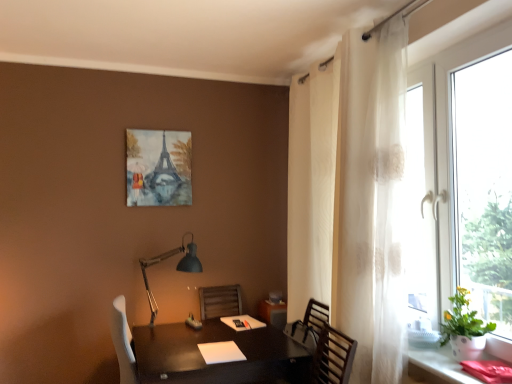
Question: From the image's perspective, is watercolor paper painting of eiffel tower at upper center above white sheer curtain at right?

Choices:
 (A) yes
 (B) no

Answer: (A)

Question: Considering the relative positions of watercolor paper painting of eiffel tower at upper center and white sheer curtain at right in the image provided, is watercolor paper painting of eiffel tower at upper center behind white sheer curtain at right?

Choices:
 (A) yes
 (B) no

Answer: (A)

Question: Is watercolor paper painting of eiffel tower at upper center facing away from white sheer curtain at right?

Choices:
 (A) no
 (B) yes

Answer: (A)

Question: Does watercolor paper painting of eiffel tower at upper center turn towards white sheer curtain at right?

Choices:
 (A) no
 (B) yes

Answer: (A)

Question: From the image's perspective, is watercolor paper painting of eiffel tower at upper center beneath white sheer curtain at right?

Choices:
 (A) yes
 (B) no

Answer: (B)

Question: Visually, is watercolor paper painting of eiffel tower at upper center positioned to the left or to the right of shiny dark wood table at center?

Choices:
 (A) left
 (B) right

Answer: (A)

Question: From the image's perspective, relative to shiny dark wood table at center, is watercolor paper painting of eiffel tower at upper center above or below?

Choices:
 (A) below
 (B) above

Answer: (B)

Question: Relative to shiny dark wood table at center, is watercolor paper painting of eiffel tower at upper center in front or behind?

Choices:
 (A) front
 (B) behind

Answer: (B)

Question: Is watercolor paper painting of eiffel tower at upper center spatially inside shiny dark wood table at center, or outside of it?

Choices:
 (A) inside
 (B) outside

Answer: (B)

Question: Looking at the image, does matte black desk at lower right seem bigger or smaller compared to watercolor paper painting of eiffel tower at upper center?

Choices:
 (A) big
 (B) small

Answer: (B)

Question: From a real-world perspective, is matte black desk at lower right physically located above or below watercolor paper painting of eiffel tower at upper center?

Choices:
 (A) below
 (B) above

Answer: (A)

Question: Is matte black desk at lower right taller or shorter than watercolor paper painting of eiffel tower at upper center?

Choices:
 (A) short
 (B) tall

Answer: (A)

Question: Choose the correct answer: Is matte black desk at lower right inside watercolor paper painting of eiffel tower at upper center or outside it?

Choices:
 (A) outside
 (B) inside

Answer: (A)

Question: From a real-world perspective, is matte black lamp at lower left positioned above or below white sheer curtain at right?

Choices:
 (A) above
 (B) below

Answer: (B)

Question: From the image's perspective, is matte black lamp at lower left positioned above or below white sheer curtain at right?

Choices:
 (A) above
 (B) below

Answer: (B)